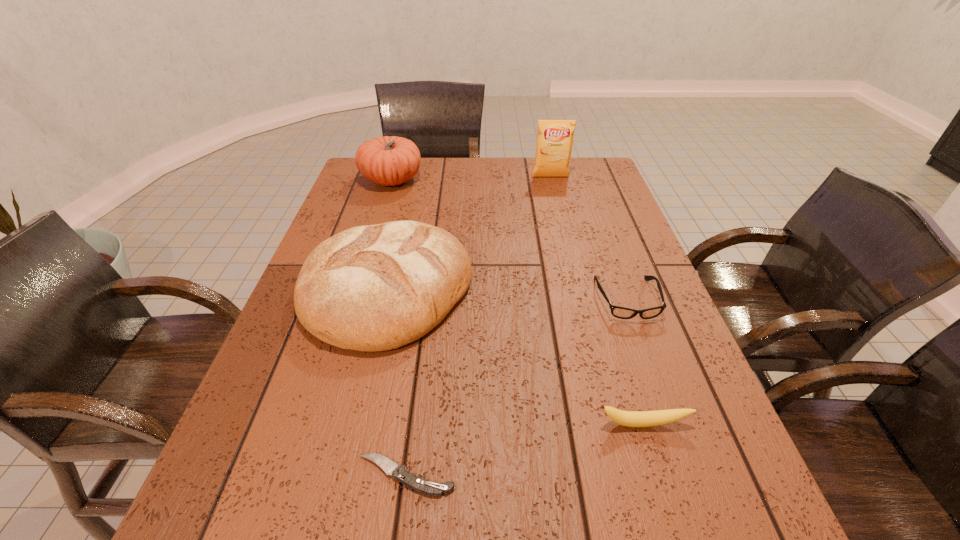
Locate an element on the screen. This screenshot has height=540, width=960. vacant area between the bread and the pocketknife is located at coordinates (396, 383).

Locate an element on the screen. free spot between the bread and the pocketknife is located at coordinates (396, 383).

In order to click on free area in between the second shortest object and the bread in this screenshot , I will do `click(507, 295)`.

Locate an element on the screen. This screenshot has width=960, height=540. the second closest object relative to the crisp (potato chip) is located at coordinates (370, 288).

Identify which object is the second closest to the spectacles. Please provide its 2D coordinates. Your answer should be formatted as a tuple, i.e. [(x, y)], where the tuple contains the x and y coordinates of a point satisfying the conditions above.

[(370, 288)]